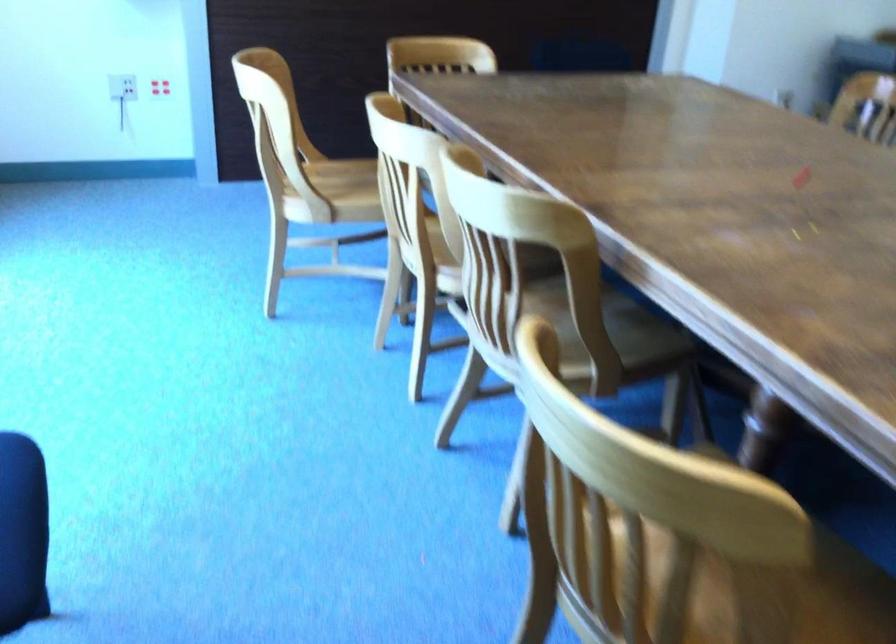
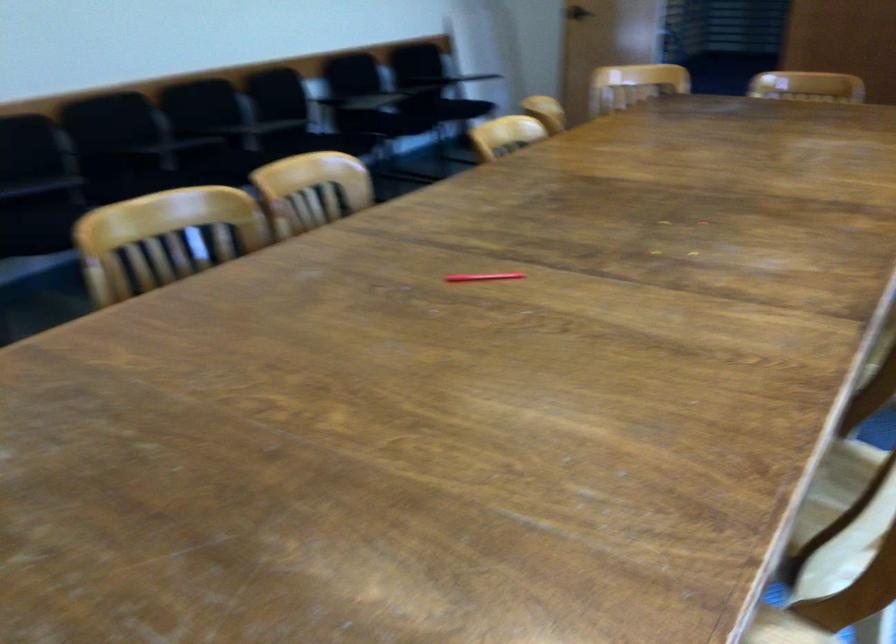
Question: I am providing you with two images of the same scene from different viewpoints. Please identify which objects are invisible in image2.

Choices:
 (A) yellow lemon container
 (B) wooden chair sitting surface
 (C) red pen
 (D) black chair sitting surface

Answer: (B)